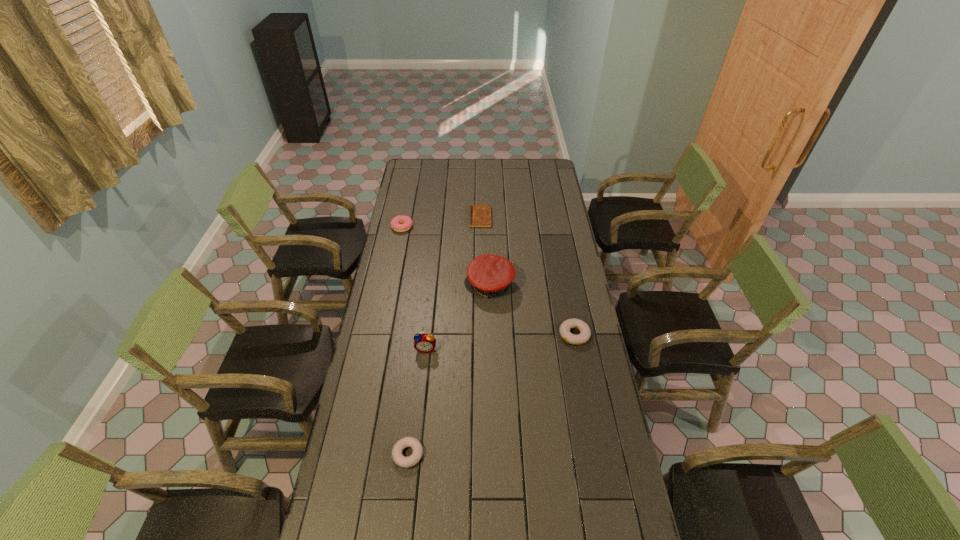
Identify the location of spot to insert another doughnut for uniform distribution. (500, 388).